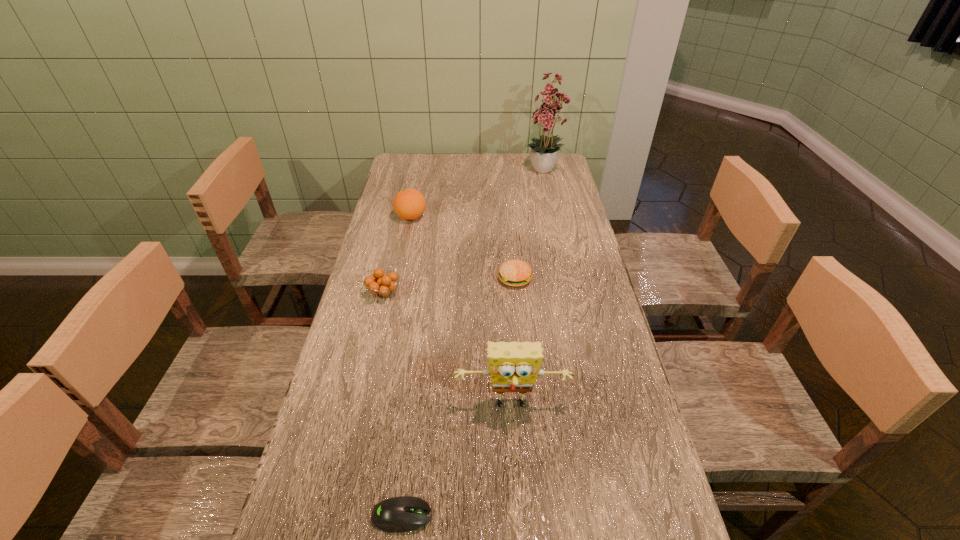
Image resolution: width=960 pixels, height=540 pixels. In order to click on unoccupied position between the flower arrangement and the fifth shortest object in this screenshot , I will do `click(528, 289)`.

At what (x,y) coordinates should I click in order to perform the action: click on vacant space that is in between the sponge and the flower arrangement. Please return your answer as a coordinate pair (x, y). Looking at the image, I should click on (528, 289).

Locate an element on the screen. This screenshot has width=960, height=540. vacant space in between the flower arrangement and the second tallest object is located at coordinates (528, 289).

Identify which object is the fifth closest to the nearer orange fruit. Please provide its 2D coordinates. Your answer should be formatted as a tuple, i.e. [(x, y)], where the tuple contains the x and y coordinates of a point satisfying the conditions above.

[(543, 152)]

Identify which object is the second closest to the fifth shortest object. Please provide its 2D coordinates. Your answer should be formatted as a tuple, i.e. [(x, y)], where the tuple contains the x and y coordinates of a point satisfying the conditions above.

[(380, 284)]

Find the location of a particular element. This screenshot has height=540, width=960. blank area in the image that satisfies the following two spatial constraints: 1. on the face of the sponge; 2. on the wheel side of the nearest object is located at coordinates (518, 516).

Locate an element on the screen. The height and width of the screenshot is (540, 960). vacant position in the image that satisfies the following two spatial constraints: 1. on the front-facing side of the tallest object; 2. on the wheel side of the nearest object is located at coordinates (621, 516).

Where is `free space in the image that satisfies the following two spatial constraints: 1. on the front-facing side of the flower arrangement; 2. on the wheel side of the computer mouse`? free space in the image that satisfies the following two spatial constraints: 1. on the front-facing side of the flower arrangement; 2. on the wheel side of the computer mouse is located at coordinates (621, 516).